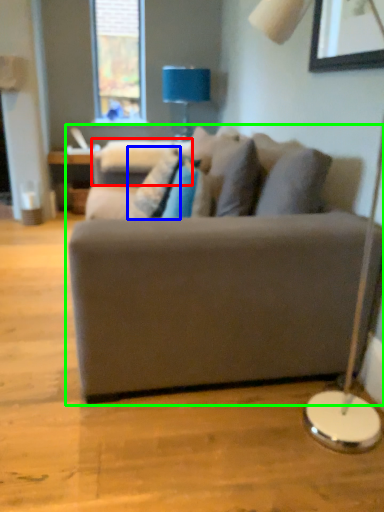
Question: Estimate the real-world distances between objects in this image. Which object is closer to swivel chair (highlighted by a red box), pillow (highlighted by a blue box) or studio couch (highlighted by a green box)?

Choices:
 (A) pillow
 (B) studio couch

Answer: (A)